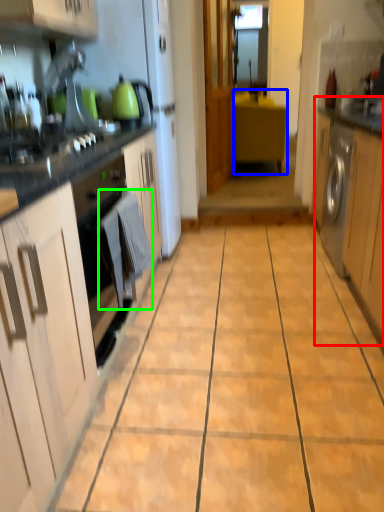
Question: Which object is the closest to the cabinetry (highlighted by a red box)? Choose among these: cabinetry (highlighted by a blue box) or laundry (highlighted by a green box).

Choices:
 (A) cabinetry
 (B) laundry

Answer: (B)